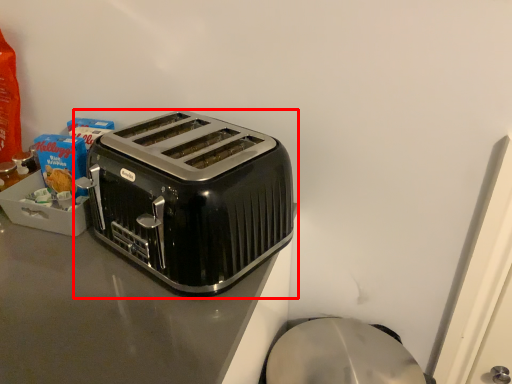
Question: From the image's perspective, what is the correct spatial relationship of toaster (annotated by the red box) in relation to counter top?

Choices:
 (A) below
 (B) above

Answer: (B)